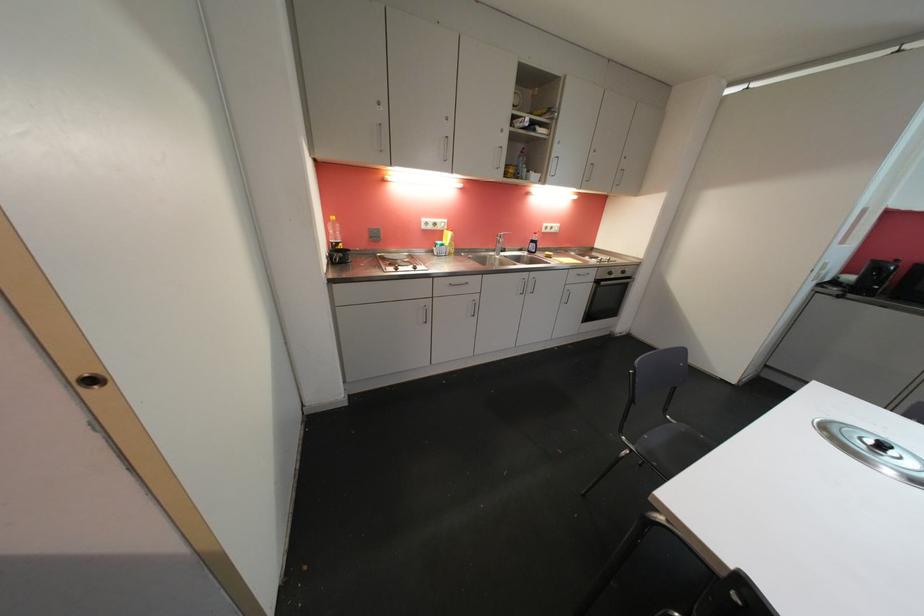
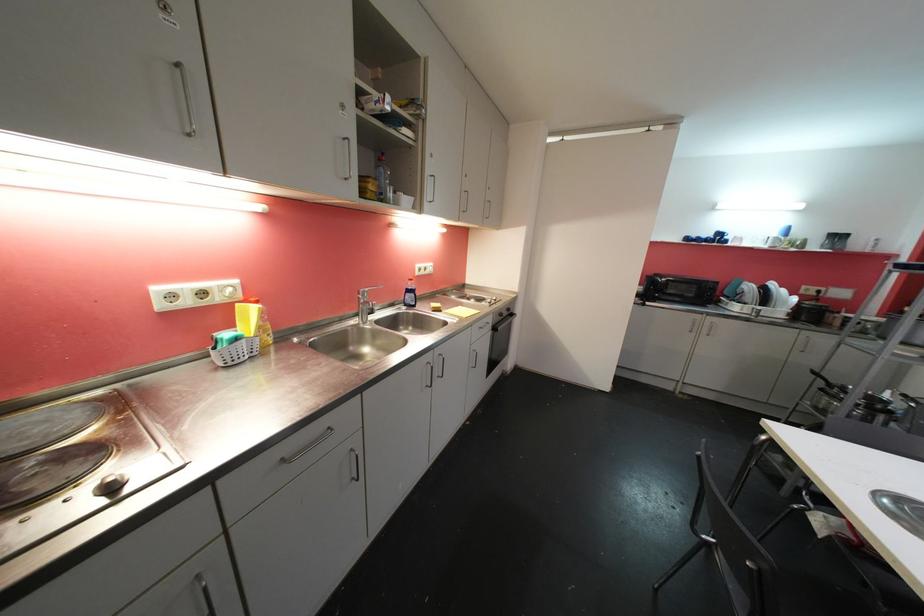
Find the pixel in the second image that matches (537,244) in the first image.

(414, 293)